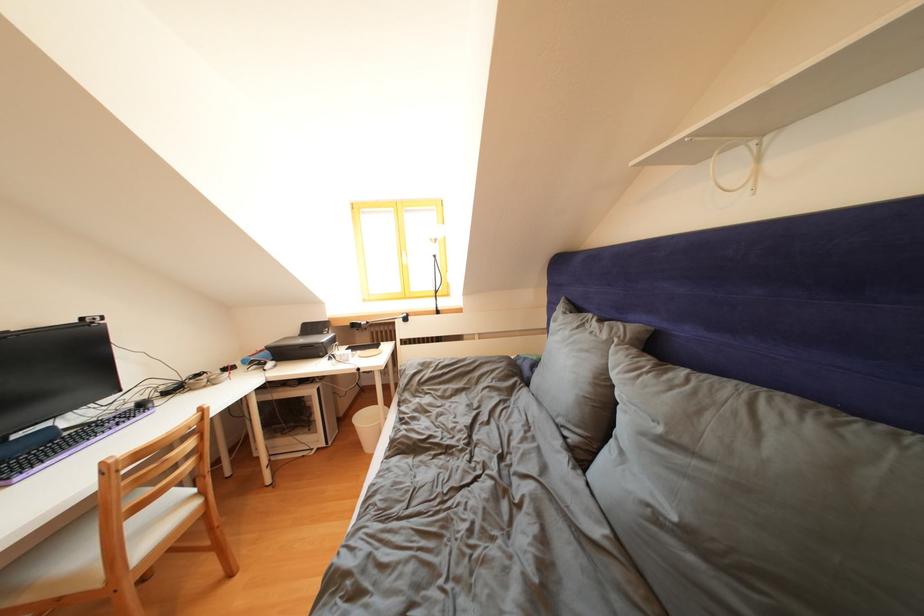
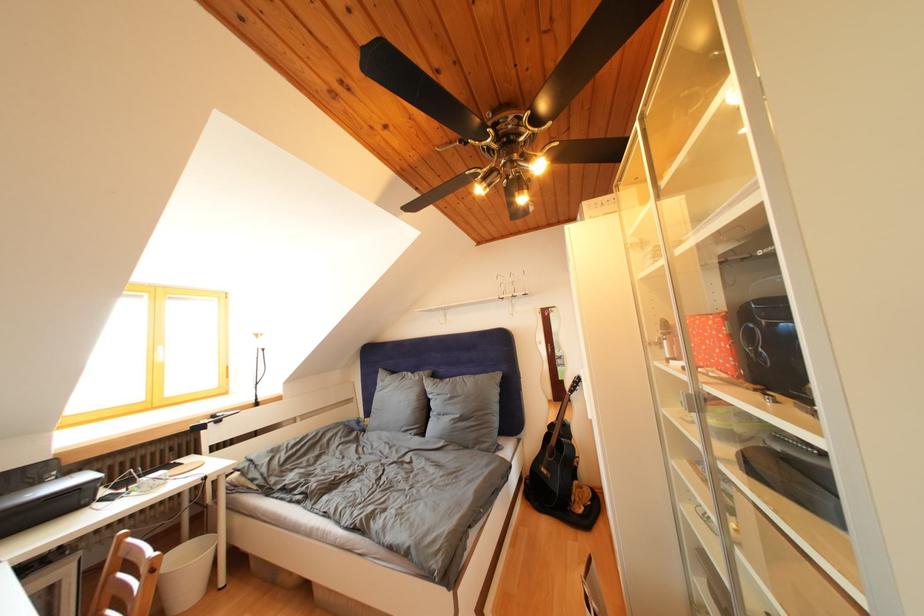
The point at [612,341] is marked in the first image. Where is the corresponding point in the second image?

(426, 383)